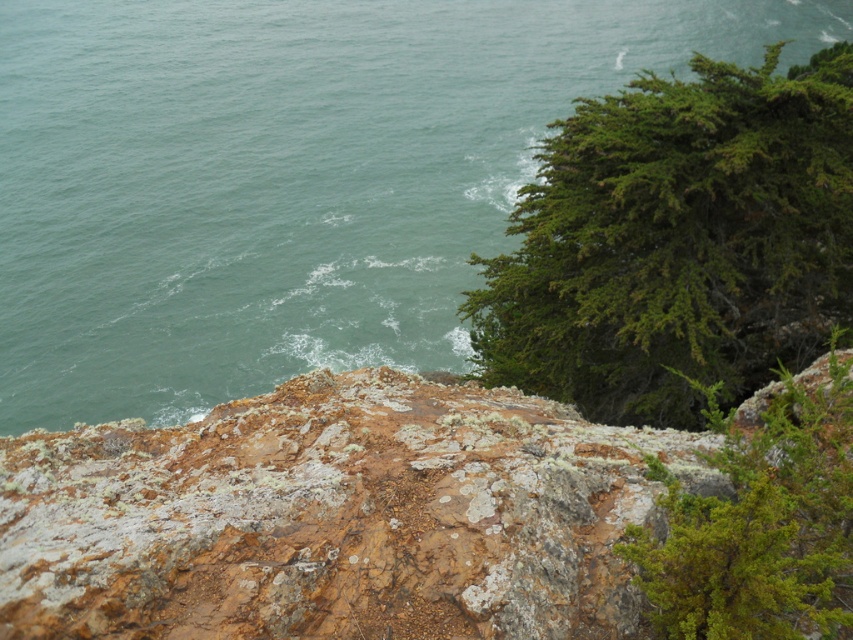
Does green water at upper left have a greater width compared to lichen-covered rock at center?

Yes, green water at upper left is wider than lichen-covered rock at center.

The image size is (853, 640). What do you see at coordinates (288, 179) in the screenshot?
I see `green water at upper left` at bounding box center [288, 179].

Does point (38, 92) come closer to viewer compared to point (265, 468)?

No.

I want to click on green water at upper left, so click(x=288, y=179).